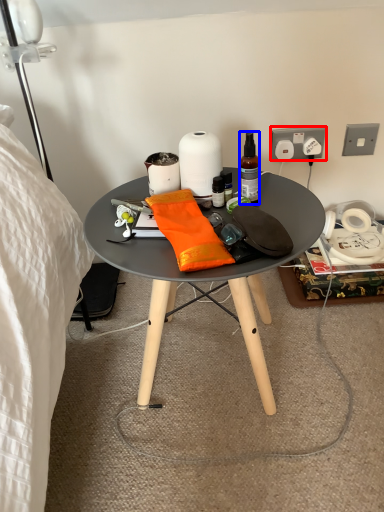
Question: Which object appears closest to the camera in this image, power outlet (highlighted by a red box) or bottle (highlighted by a blue box)?

Choices:
 (A) power outlet
 (B) bottle

Answer: (B)